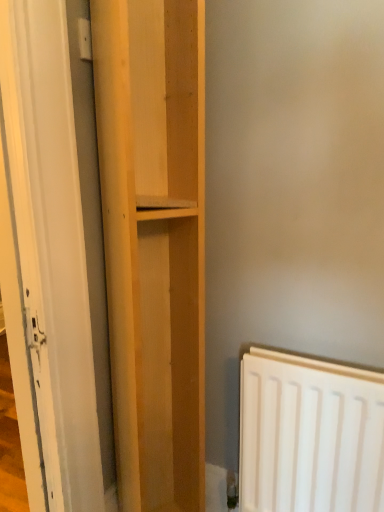
Locate an element on the screen. white glossy door at left is located at coordinates (54, 257).

What do you see at coordinates (54, 257) in the screenshot? This screenshot has height=512, width=384. I see `white glossy door at left` at bounding box center [54, 257].

Describe the element at coordinates (154, 243) in the screenshot. Image resolution: width=384 pixels, height=512 pixels. I see `light wood shelf at center` at that location.

You are a GUI agent. You are given a task and a screenshot of the screen. Output one action in this format:
    pyautogui.click(x=<x>, y=<y>)
    Task: Click on the light wood shelf at center
    The height and width of the screenshot is (512, 384).
    Given the screenshot: What is the action you would take?
    pyautogui.click(x=154, y=243)

The image size is (384, 512). Identify the location of white glossy door at left. (54, 257).

Considering the positions of objects light wood shelf at center and white glossy door at left in the image provided, who is more to the right, light wood shelf at center or white glossy door at left?

light wood shelf at center.

Which object is closer to the camera, light wood shelf at center or white glossy door at left?

Positioned in front is white glossy door at left.

Is point (136, 21) closer or farther from the camera than point (3, 187)?

Clearly, point (136, 21) is more distant from the camera than point (3, 187).

From the image's perspective, which is below, light wood shelf at center or white glossy door at left?

From the image's view, light wood shelf at center is below.

From a real-world perspective, who is located lower, light wood shelf at center or white glossy door at left?

In real-world perspective, light wood shelf at center is lower.

Is light wood shelf at center thinner than white glossy door at left?

No.

In terms of height, does light wood shelf at center look taller or shorter compared to white glossy door at left?

In the image, light wood shelf at center appears to be taller than white glossy door at left.

Consider the image. Considering the relative sizes of light wood shelf at center and white glossy door at left in the image provided, is light wood shelf at center bigger than white glossy door at left?

Yes, light wood shelf at center is bigger than white glossy door at left.

Is light wood shelf at center located outside white glossy door at left?

Indeed, light wood shelf at center is completely outside white glossy door at left.

Would you consider light wood shelf at center to be distant from white glossy door at left?

No, light wood shelf at center is not far away from white glossy door at left.

Is light wood shelf at center positioned with its back to white glossy door at left?

No.

You are a GUI agent. You are given a task and a screenshot of the screen. Output one action in this format:
    pyautogui.click(x=<x>, y=<y>)
    Task: Click on the cupboard behind the white glossy door at left
    Image resolution: width=384 pixels, height=512 pixels.
    Given the screenshot: What is the action you would take?
    pyautogui.click(x=154, y=243)

Based on the photo, considering the relative positions of white glossy door at left and light wood shelf at center in the image provided, is white glossy door at left to the right of light wood shelf at center from the viewer's perspective?

No.

Who is more distant, white glossy door at left or light wood shelf at center?

light wood shelf at center.

Which point is more forward, (108, 447) or (167, 230)?

Positioned in front is point (167, 230).

From the image's perspective, is white glossy door at left located above light wood shelf at center?

Yes, from the image's perspective, white glossy door at left is over light wood shelf at center.

From a real-world perspective, who is located higher, white glossy door at left or light wood shelf at center?

white glossy door at left, from a real-world perspective.

Considering the relative sizes of white glossy door at left and light wood shelf at center in the image provided, is white glossy door at left thinner than light wood shelf at center?

Correct, the width of white glossy door at left is less than that of light wood shelf at center.

Considering the sizes of objects white glossy door at left and light wood shelf at center in the image provided, who is shorter, white glossy door at left or light wood shelf at center?

With less height is white glossy door at left.

Considering the sizes of white glossy door at left and light wood shelf at center in the image, is white glossy door at left bigger or smaller than light wood shelf at center?

Clearly, white glossy door at left is smaller in size than light wood shelf at center.

Consider the image. Would you say white glossy door at left is outside light wood shelf at center?

Yes, white glossy door at left is outside of light wood shelf at center.

Is white glossy door at left touching light wood shelf at center?

They are not placed beside each other.

Is white glossy door at left facing away from light wood shelf at center?

That's not correct — white glossy door at left is not looking away from light wood shelf at center.

What's the angular difference between white glossy door at left and light wood shelf at center's facing directions?

They differ by 32.5 degrees in their facing directions.

Where is `cupboard that is below the white glossy door at left (from the image's perspective)`? The height and width of the screenshot is (512, 384). cupboard that is below the white glossy door at left (from the image's perspective) is located at coordinates (154, 243).

Where is `cupboard directly beneath the white glossy door at left (from a real-world perspective)`? cupboard directly beneath the white glossy door at left (from a real-world perspective) is located at coordinates click(154, 243).

At what (x,y) coordinates should I click in order to perform the action: click on door on the left side of light wood shelf at center. Please return your answer as a coordinate pair (x, y). This screenshot has height=512, width=384. Looking at the image, I should click on (54, 257).